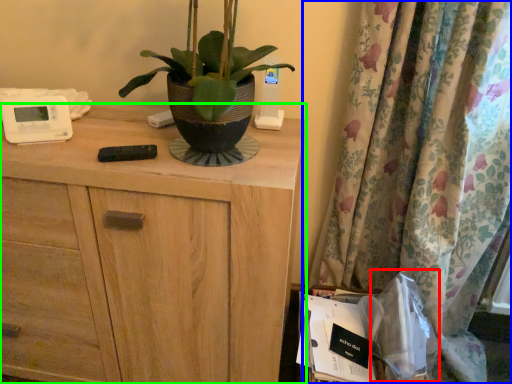
Question: Which is nearer to the paper bag (highlighted by a red box)? curtain (highlighted by a blue box) or chest of drawers (highlighted by a green box).

Choices:
 (A) curtain
 (B) chest of drawers

Answer: (A)